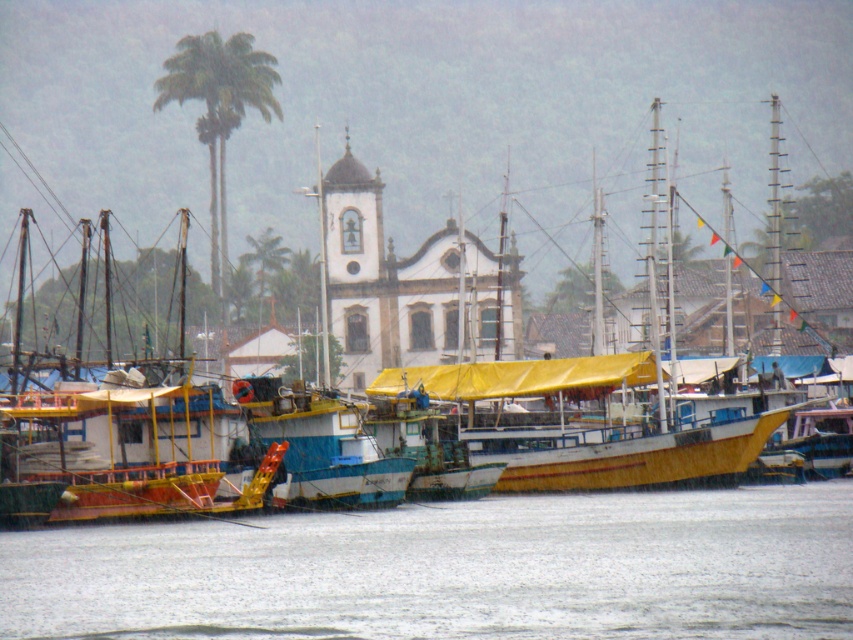
Question: Does transparent water at lower center come in front of green leafy palm tree at upper left?

Choices:
 (A) no
 (B) yes

Answer: (B)

Question: Can you confirm if transparent water at lower center is positioned above green leafy palm tree at upper left?

Choices:
 (A) yes
 (B) no

Answer: (B)

Question: From the image, what is the correct spatial relationship of transparent water at lower center in relation to green leafy palm tree at upper left?

Choices:
 (A) above
 (B) below

Answer: (B)

Question: Which of the following is the closest to the observer?

Choices:
 (A) green leafy palm tree at upper left
 (B) transparent water at lower center

Answer: (B)

Question: Among these points, which one is farthest from the camera?

Choices:
 (A) (511, 614)
 (B) (247, 42)

Answer: (B)